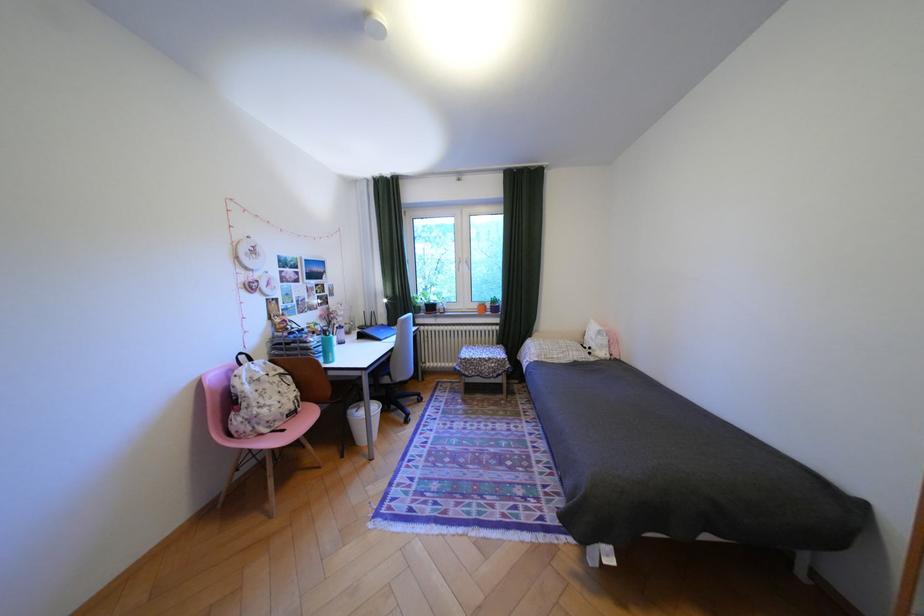
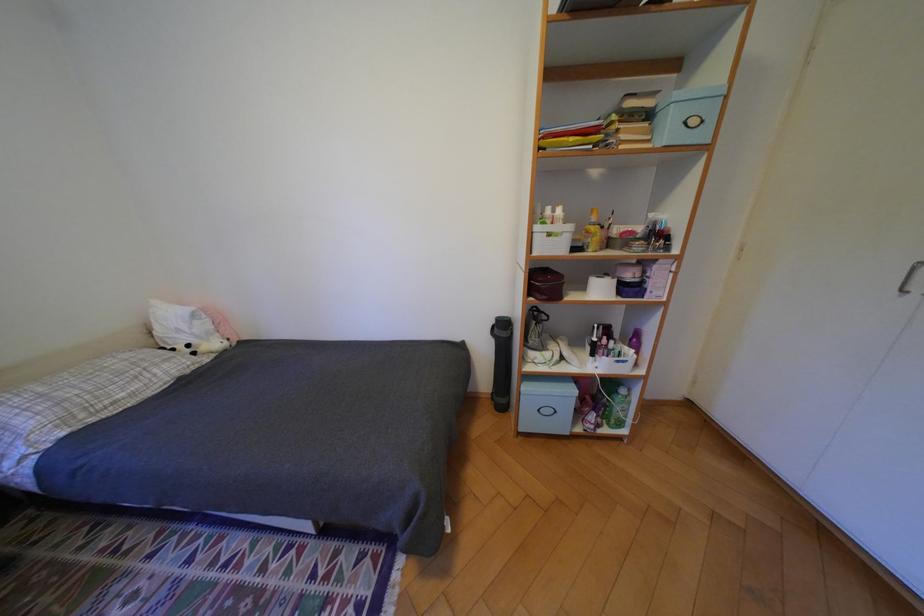
Based on the continuous images, in which direction is the camera rotating?

The rotation direction of the camera is right-down.